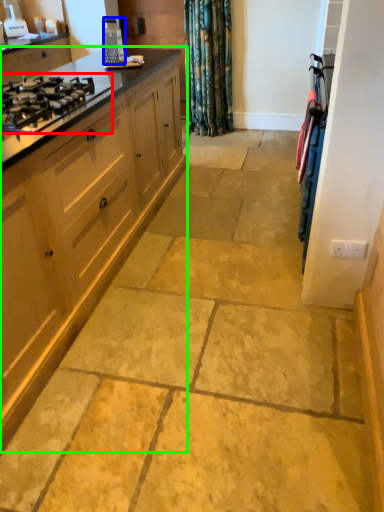
Question: Which is nearer to the gas stove (highlighted by a red box)? appliance (highlighted by a blue box) or cabinetry (highlighted by a green box).

Choices:
 (A) appliance
 (B) cabinetry

Answer: (B)